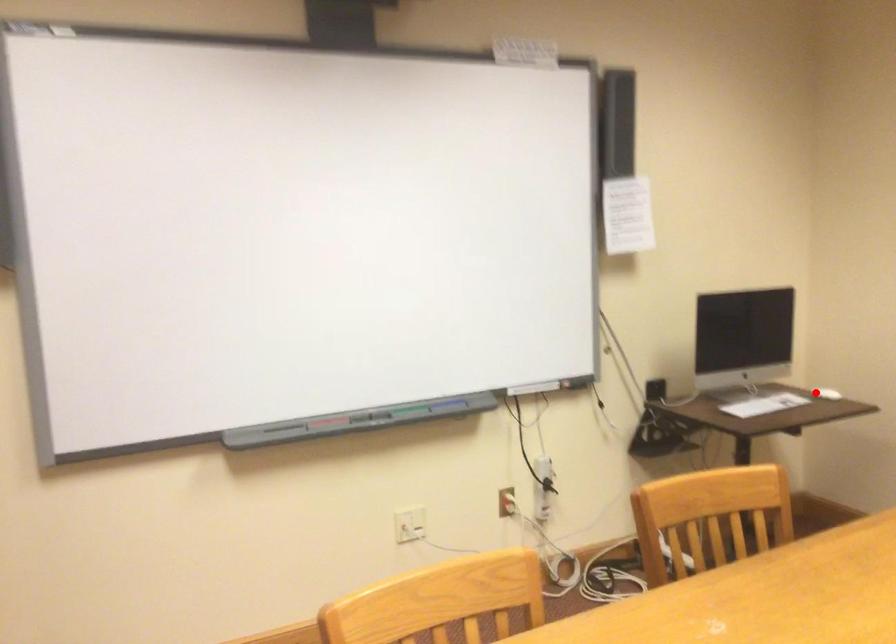
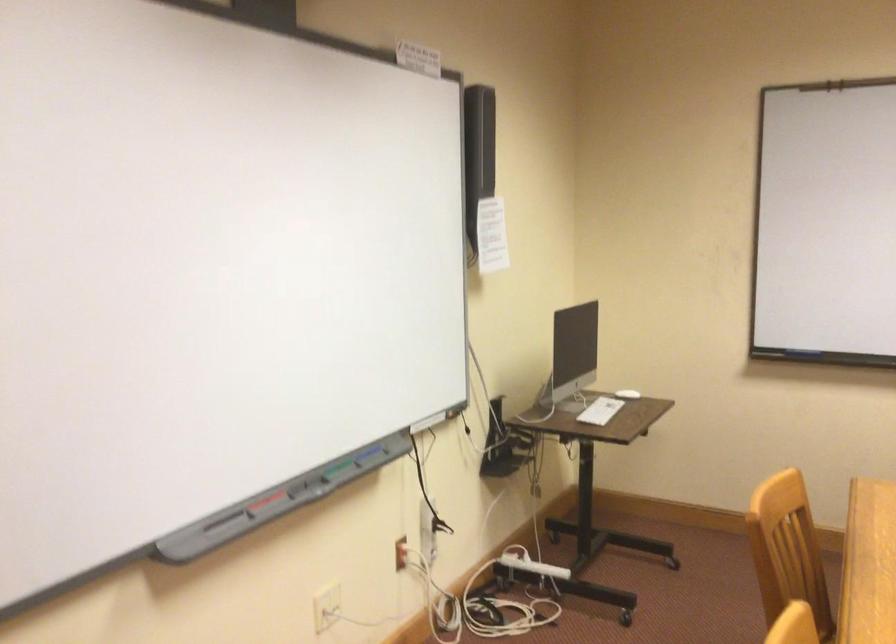
Question: I am providing you with two images of the same scene from different viewpoints. A red point is marked on the first image. Can you still see the location of the red point in image 2?

Choices:
 (A) Yes
 (B) No

Answer: (A)